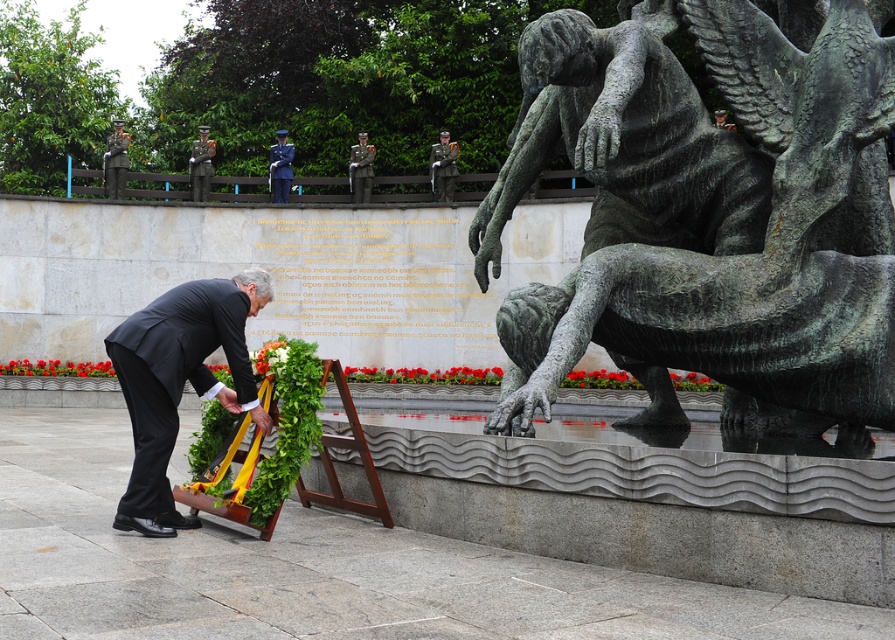
Looking at this image, who is more distant from viewer, (x=291, y=157) or (x=720, y=113)?

Positioned behind is point (x=291, y=157).

You are a GUI agent. You are given a task and a screenshot of the screen. Output one action in this format:
    pyautogui.click(x=<x>, y=<y>)
    Task: Click on the shiny blue uniform at center
    Image resolution: width=895 pixels, height=640 pixels.
    Given the screenshot: What is the action you would take?
    pyautogui.click(x=280, y=168)

Is point (13, 362) positioned in front of point (734, 124)?

Yes, it is in front of point (734, 124).

Can you confirm if green leafy wreath at lower left is wider than matte bronze statue at upper right?

Yes, green leafy wreath at lower left is wider than matte bronze statue at upper right.

I want to click on green leafy wreath at lower left, so click(x=56, y=369).

Who is higher up, shiny silver uniform at center or shiny blue uniform at center?

shiny blue uniform at center is above.

Who is more forward, (365, 148) or (275, 177)?

Positioned in front is point (365, 148).

You are a GUI agent. You are given a task and a screenshot of the screen. Output one action in this format:
    pyautogui.click(x=<x>, y=<y>)
    Task: Click on the shiny silver uniform at center
    Image resolution: width=895 pixels, height=640 pixels.
    Given the screenshot: What is the action you would take?
    pyautogui.click(x=361, y=168)